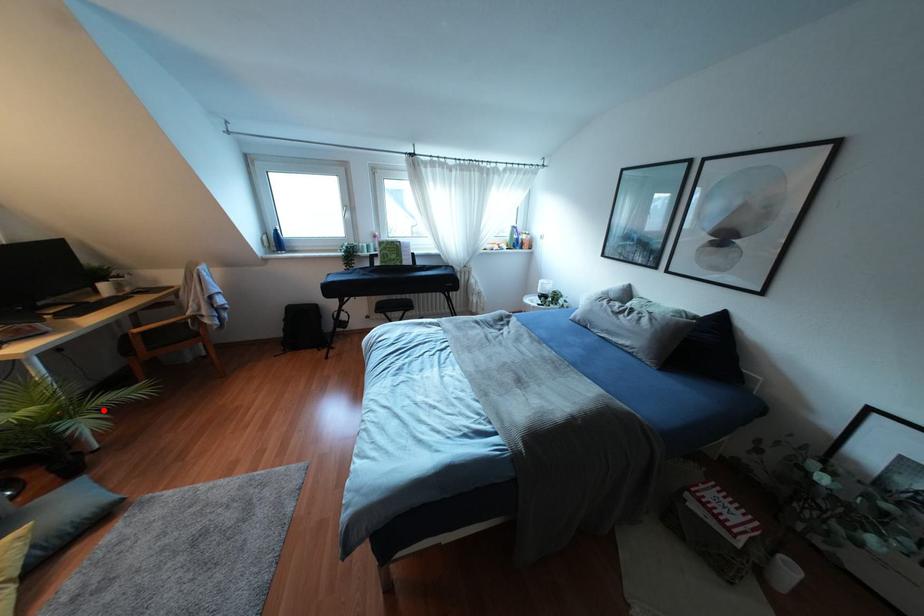
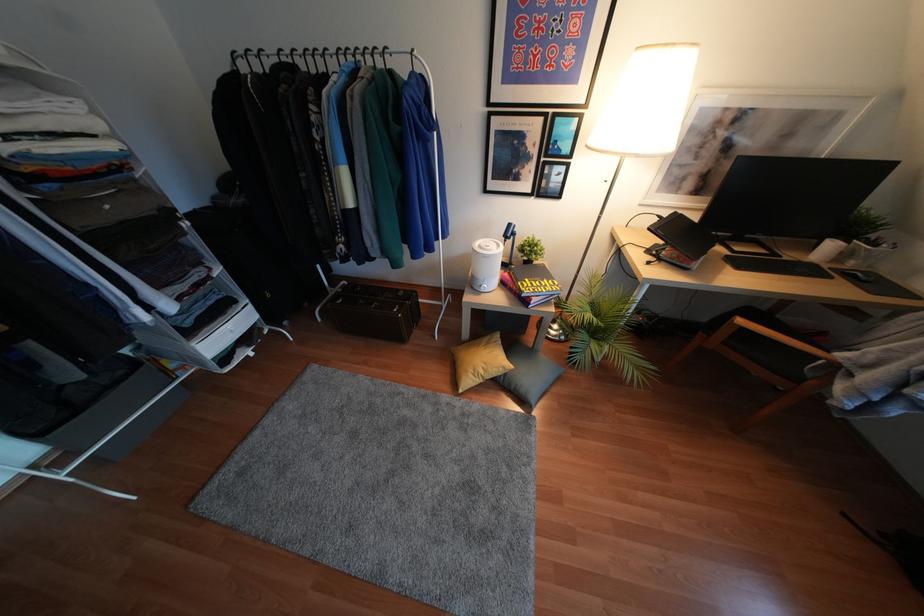
The point at the highlighted location is marked in the first image. Where is the corresponding point in the second image?

(604, 357)